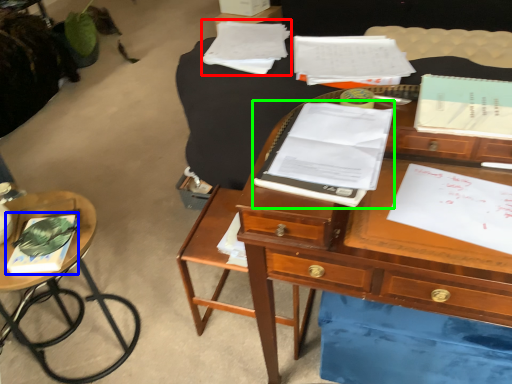
Question: Considering the real-world distances, which object is closest to notebook (highlighted by a red box)? book (highlighted by a blue box) or notebook (highlighted by a green box).

Choices:
 (A) book
 (B) notebook

Answer: (B)